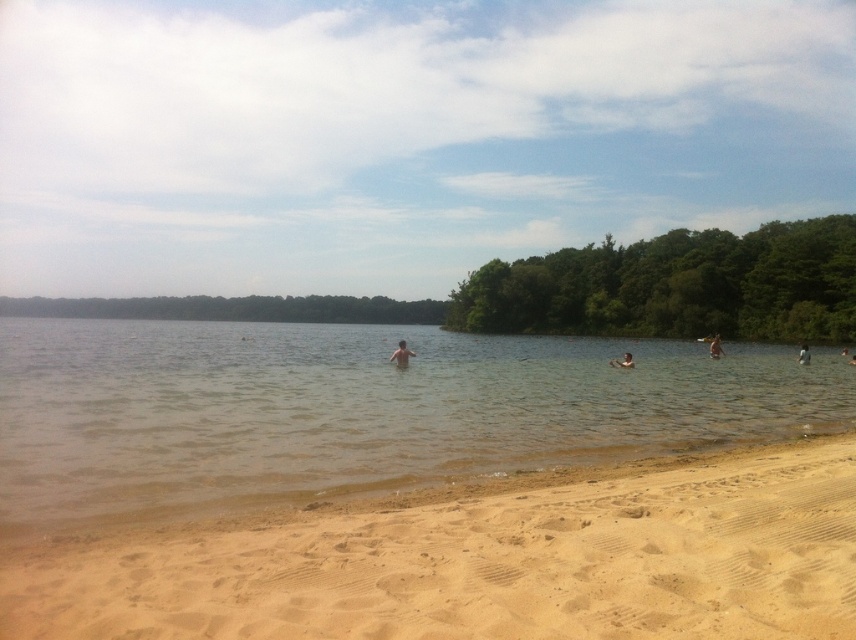
Consider the image. Which is more to the left, dark skin human at center or brown skin at upper center?

dark skin human at center

Is dark skin human at center above brown skin at upper center?

Yes.

Image resolution: width=856 pixels, height=640 pixels. What are the coordinates of `dark skin human at center` in the screenshot? It's located at (623, 360).

Does tan skin person at center have a larger size compared to dark skin human at center?

Yes.

Who is positioned more to the left, tan skin person at center or dark skin human at center?

dark skin human at center is more to the left.

Identify the location of tan skin person at center. (715, 346).

Find the location of a particular element. tan skin person at center is located at coordinates (715, 346).

Can you confirm if fine-grained sand at lower center is smaller than dark skin human at center?

Correct, fine-grained sand at lower center occupies less space than dark skin human at center.

Can you confirm if fine-grained sand at lower center is positioned to the left of dark skin human at center?

Correct, you'll find fine-grained sand at lower center to the left of dark skin human at center.

Does point (99, 627) come in front of point (616, 358)?

Yes, it is in front of point (616, 358).

This screenshot has width=856, height=640. Identify the location of fine-grained sand at lower center. (482, 561).